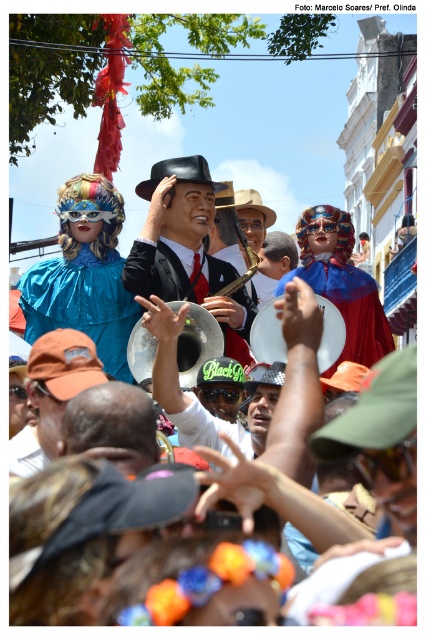
Is shiny black hat at center positioned in front of shiny blue fabric at left?

Yes, it is.

Is shiny black hat at center below shiny blue fabric at left?

Yes.

The image size is (426, 640). Find the location of `shiny black hat at center`. shiny black hat at center is located at coordinates coord(278,499).

Does shiny blue fabric at left appear on the right side of shiny red cape at center?

Incorrect, shiny blue fabric at left is not on the right side of shiny red cape at center.

Is point (94, 259) positioned behind point (383, 348)?

That is False.

Locate an element on the screen. shiny blue fabric at left is located at coordinates (81, 304).

This screenshot has width=426, height=640. What do you see at coordinates (278, 499) in the screenshot?
I see `shiny black hat at center` at bounding box center [278, 499].

Does shiny black hat at center have a lesser height compared to shiny black suit at center?

Indeed, shiny black hat at center has a lesser height compared to shiny black suit at center.

Is point (189, 616) closer to camera compared to point (164, 200)?

Yes, it is in front of point (164, 200).

At what (x,y) coordinates should I click in order to perform the action: click on shiny black hat at center. Please return your answer as a coordinate pair (x, y). The width and height of the screenshot is (426, 640). Looking at the image, I should click on (278, 499).